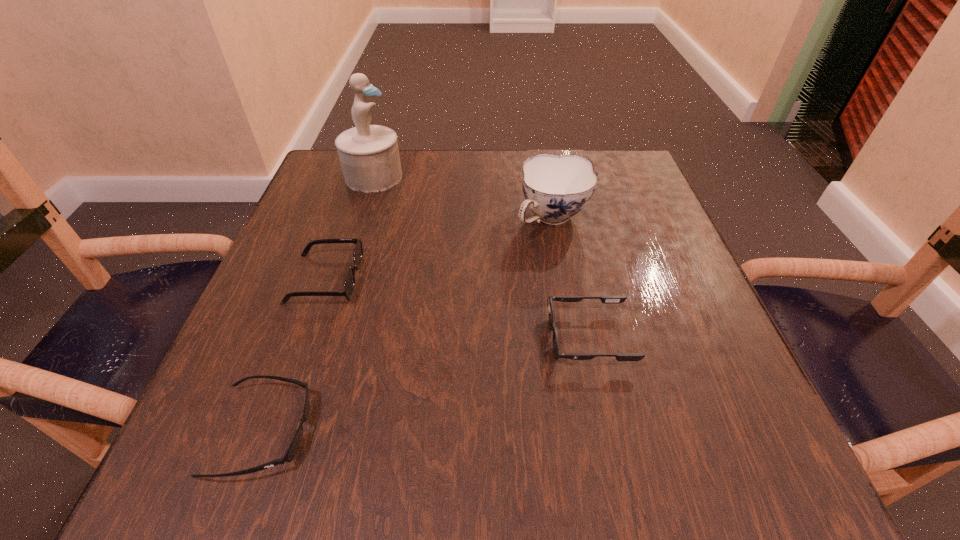
This screenshot has width=960, height=540. What are the coordinates of `the farthest object` in the screenshot? It's located at (369, 155).

Identify the location of figurine. The height and width of the screenshot is (540, 960). (369, 155).

Image resolution: width=960 pixels, height=540 pixels. I want to click on the fourth nearest object, so click(x=556, y=187).

At what (x,y) coordinates should I click in order to perform the action: click on the second tallest object. Please return your answer as a coordinate pair (x, y). Looking at the image, I should click on (556, 187).

At what (x,y) coordinates should I click in order to perform the action: click on the farthest sunglasses. Please return your answer as a coordinate pair (x, y). Looking at the image, I should click on (349, 283).

You are a GUI agent. You are given a task and a screenshot of the screen. Output one action in this format:
    pyautogui.click(x=<x>, y=<y>)
    Task: Click on the third shortest object
    The width and height of the screenshot is (960, 540).
    Given the screenshot: What is the action you would take?
    pyautogui.click(x=349, y=283)

What are the coordinates of `the second farthest sunglasses` in the screenshot? It's located at (604, 299).

You are a GUI agent. You are given a task and a screenshot of the screen. Output one action in this format:
    pyautogui.click(x=<x>, y=<y>)
    Task: Click on the second nearest object
    Image resolution: width=960 pixels, height=540 pixels.
    Given the screenshot: What is the action you would take?
    pyautogui.click(x=604, y=299)

The image size is (960, 540). Identify the location of the nearest sunglasses. (291, 452).

Identify the location of vacant space located 0.240m at the beak of the figurine. (504, 177).